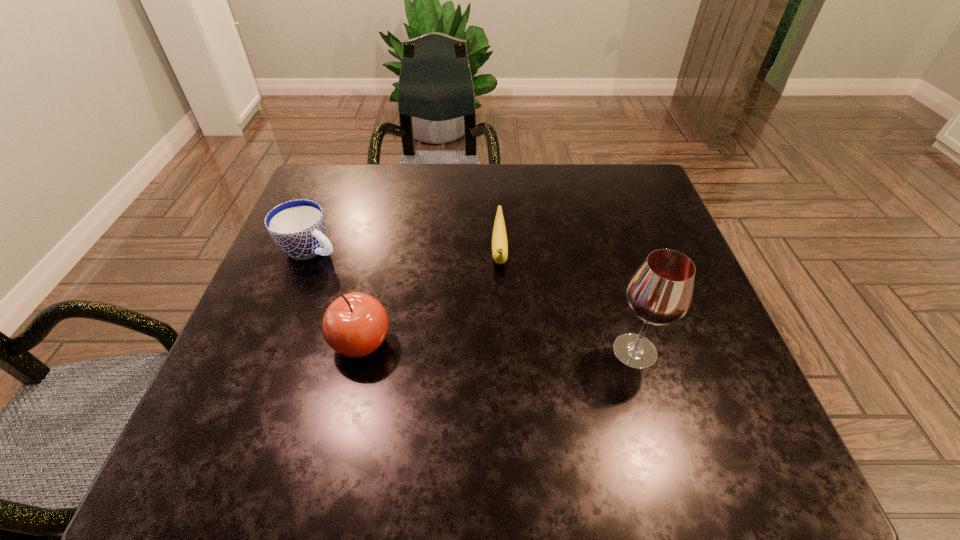
This screenshot has width=960, height=540. What are the coordinates of `free region at the left edge of the desktop` in the screenshot? It's located at (326, 220).

In the image, there is a desktop. In order to click on free space at the right edge in this screenshot , I will do `click(612, 239)`.

Identify the location of vacant area at the far left corner. The width and height of the screenshot is (960, 540). (336, 206).

Identify the location of vacant area that lies between the cup and the second object from left to right. tap(336, 295).

The height and width of the screenshot is (540, 960). I want to click on vacant area that lies between the second object from right to left and the second object from left to right, so click(430, 298).

This screenshot has height=540, width=960. Find the location of `vacant space that's between the wineglass and the cup`. vacant space that's between the wineglass and the cup is located at coordinates (473, 300).

This screenshot has width=960, height=540. Identify the location of free point between the leftmost object and the banana. (405, 251).

The image size is (960, 540). What are the coordinates of `vacant space in between the third object from left to right and the rightmost object` in the screenshot? It's located at (567, 302).

I want to click on free point between the banana and the leftmost object, so click(405, 251).

You are a GUI agent. You are given a task and a screenshot of the screen. Output one action in this format:
    pyautogui.click(x=<x>, y=<y>)
    Task: Click on the vacant area that lies between the third object from right to left and the tallest object
    This screenshot has width=960, height=540.
    Given the screenshot: What is the action you would take?
    pyautogui.click(x=498, y=347)